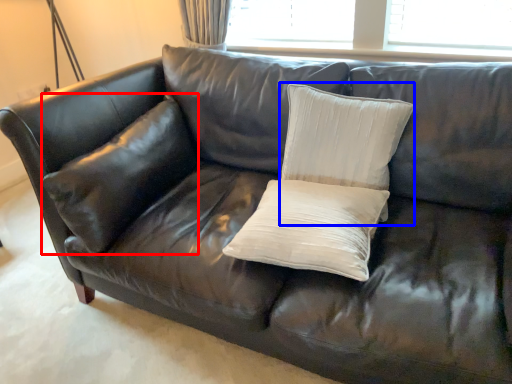
Question: Which point is further to the camera, pillow (highlighted by a red box) or pillow (highlighted by a blue box)?

Choices:
 (A) pillow
 (B) pillow

Answer: (A)